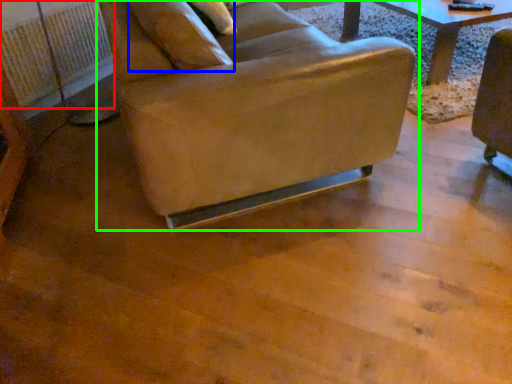
Question: Considering the real-world distances, which object is closest to radiator (highlighted by a red box)? pillow (highlighted by a blue box) or chair (highlighted by a green box).

Choices:
 (A) pillow
 (B) chair

Answer: (B)